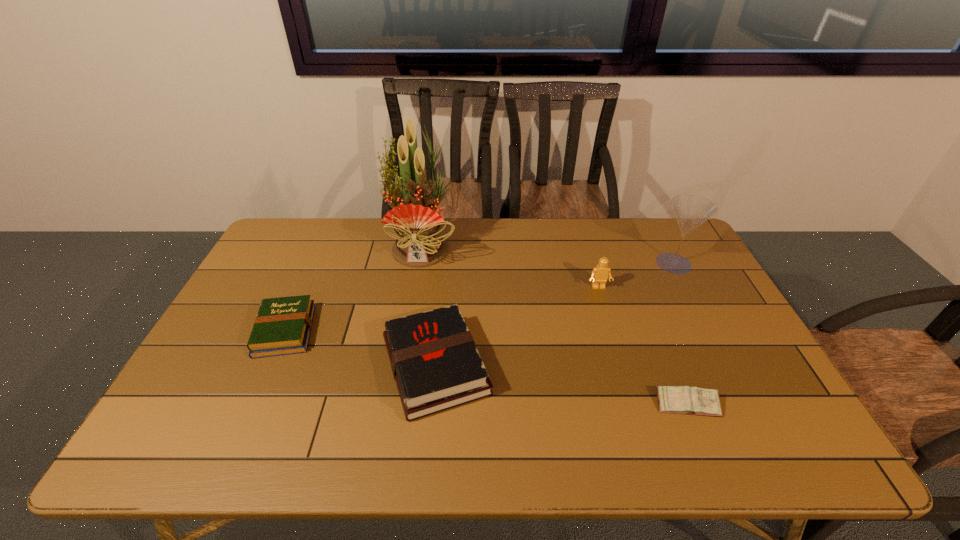
Locate an element on the screen. This screenshot has height=540, width=960. free region that satisfies the following two spatial constraints: 1. on the back side of the hardback book; 2. on the right side of the flute glass is located at coordinates (444, 263).